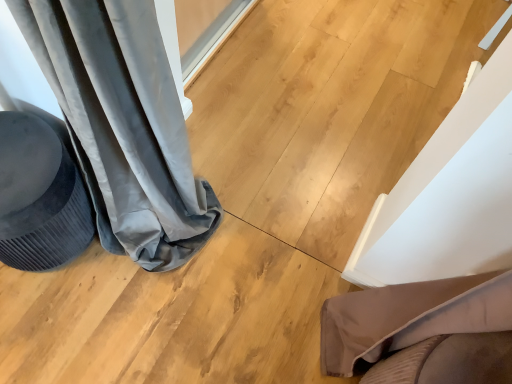
The width and height of the screenshot is (512, 384). Describe the element at coordinates (410, 316) in the screenshot. I see `brown fabric cushion at lower right` at that location.

Locate an element on the screen. brown fabric cushion at lower right is located at coordinates (410, 316).

Describe the element at coordinates (39, 197) in the screenshot. I see `velvet dark gray swivel chair at left` at that location.

Locate an element on the screen. The width and height of the screenshot is (512, 384). velvet dark gray swivel chair at left is located at coordinates (39, 197).

Identify the location of brown fabric cushion at lower right. (410, 316).

In the scene shown: Can you confirm if brown fabric cushion at lower right is positioned to the left of velvet dark gray swivel chair at left?

In fact, brown fabric cushion at lower right is to the right of velvet dark gray swivel chair at left.

Which object is further away from the camera, brown fabric cushion at lower right or velvet dark gray swivel chair at left?

velvet dark gray swivel chair at left is further away from the camera.

Considering the points (444, 325) and (0, 176), which point is behind, point (444, 325) or point (0, 176)?

Positioned behind is point (0, 176).

From the image's perspective, which is above, brown fabric cushion at lower right or velvet dark gray swivel chair at left?

velvet dark gray swivel chair at left.

From a real-world perspective, which is physically below, brown fabric cushion at lower right or velvet dark gray swivel chair at left?

velvet dark gray swivel chair at left.

Between brown fabric cushion at lower right and velvet dark gray swivel chair at left, which one has smaller width?

brown fabric cushion at lower right.

Does brown fabric cushion at lower right have a lesser height compared to velvet dark gray swivel chair at left?

No.

Based on their sizes in the image, would you say brown fabric cushion at lower right is bigger or smaller than velvet dark gray swivel chair at left?

brown fabric cushion at lower right is smaller than velvet dark gray swivel chair at left.

Would you say brown fabric cushion at lower right is inside or outside velvet dark gray swivel chair at left?

brown fabric cushion at lower right is located beyond the bounds of velvet dark gray swivel chair at left.

Is brown fabric cushion at lower right far from velvet dark gray swivel chair at left?

No, there isn't a large distance between brown fabric cushion at lower right and velvet dark gray swivel chair at left.

Could you tell me if brown fabric cushion at lower right is turned towards velvet dark gray swivel chair at left?

No, brown fabric cushion at lower right is not turned towards velvet dark gray swivel chair at left.

How many degrees apart are the facing directions of brown fabric cushion at lower right and velvet dark gray swivel chair at left?

The angle between the facing direction of brown fabric cushion at lower right and the facing direction of velvet dark gray swivel chair at left is 9.99 degrees.

The height and width of the screenshot is (384, 512). In order to click on furniture on the right of the velvet dark gray swivel chair at left in this screenshot , I will do `click(410, 316)`.

Considering the relative positions of velvet dark gray swivel chair at left and brown fabric cushion at lower right in the image provided, is velvet dark gray swivel chair at left to the left of brown fabric cushion at lower right from the viewer's perspective?

Yes, velvet dark gray swivel chair at left is to the left of brown fabric cushion at lower right.

Is the depth of velvet dark gray swivel chair at left less than that of brown fabric cushion at lower right?

No, it is not.

Is point (9, 175) closer or farther from the camera than point (417, 318)?

Point (9, 175).

From the image's perspective, which is below, velvet dark gray swivel chair at left or brown fabric cushion at lower right?

brown fabric cushion at lower right.

From a real-world perspective, does velvet dark gray swivel chair at left stand above brown fabric cushion at lower right?

No, from a real-world perspective, velvet dark gray swivel chair at left is not on top of brown fabric cushion at lower right.

Is velvet dark gray swivel chair at left thinner than brown fabric cushion at lower right?

No.

In terms of height, does velvet dark gray swivel chair at left look taller or shorter compared to brown fabric cushion at lower right?

velvet dark gray swivel chair at left is shorter than brown fabric cushion at lower right.

Is velvet dark gray swivel chair at left bigger or smaller than brown fabric cushion at lower right?

velvet dark gray swivel chair at left is bigger than brown fabric cushion at lower right.

Would you say velvet dark gray swivel chair at left is inside or outside brown fabric cushion at lower right?

velvet dark gray swivel chair at left is outside brown fabric cushion at lower right.

Is velvet dark gray swivel chair at left beside brown fabric cushion at lower right?

No, velvet dark gray swivel chair at left is not touching brown fabric cushion at lower right.

Is velvet dark gray swivel chair at left facing away from brown fabric cushion at lower right?

No.

What's the angular difference between velvet dark gray swivel chair at left and brown fabric cushion at lower right's facing directions?

The facing directions of velvet dark gray swivel chair at left and brown fabric cushion at lower right are 9.99 degrees apart.

How distant is velvet dark gray swivel chair at left from brown fabric cushion at lower right?

velvet dark gray swivel chair at left and brown fabric cushion at lower right are 33.21 inches apart.

I want to click on furniture lying below the velvet dark gray swivel chair at left (from the image's perspective), so click(x=410, y=316).

This screenshot has width=512, height=384. Identify the location of swivel chair behind the brown fabric cushion at lower right. (39, 197).

This screenshot has height=384, width=512. Find the location of `furniture in front of the velvet dark gray swivel chair at left`. furniture in front of the velvet dark gray swivel chair at left is located at coordinates (410, 316).